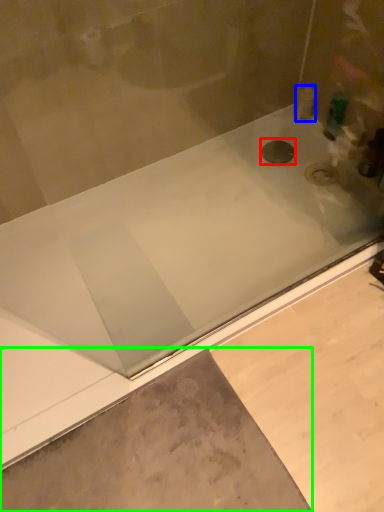
Question: Which object is positioned farthest from drain (highlighted by a red box)? Select from toiletry (highlighted by a blue box) and concrete (highlighted by a green box).

Choices:
 (A) toiletry
 (B) concrete

Answer: (B)